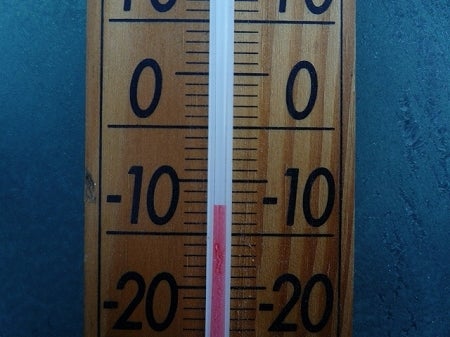
The image size is (450, 337). Find the location of `wall`. wall is located at coordinates (388, 176).